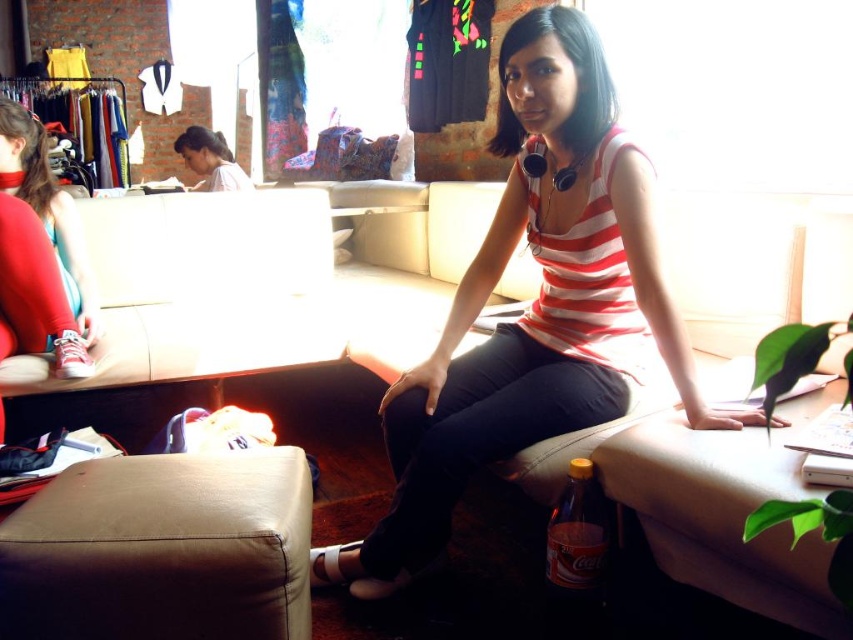
You are a delivery person who needs to place a small package between the matte red sneakers at lower left and the brown glass bottle at lower right. Can you fit the package between them if the package requires at least 5 centimeters of vertical space?

The matte red sneakers at lower left is much taller than the brown glass bottle at lower right, so there is sufficient vertical space between them to fit a package requiring at least 5 centimeters.

You are standing in the lounge and want to take a photo of the scene. You notice two points marked in the image at coordinates point (50,230) and point (555,508). Which point should you focus on first to ensure both are in sharp focus?

You should focus on point (50,230) first because it is closer to the camera than point (555,508). This ensures that the closer point is in focus, and the farther point will also be within the depth of field.

You are a fashion designer observing the scene. You see a point at coordinates [532,307]. What object is located at that point?

The point at coordinates [532,307] indicates the striped fabric top at center.